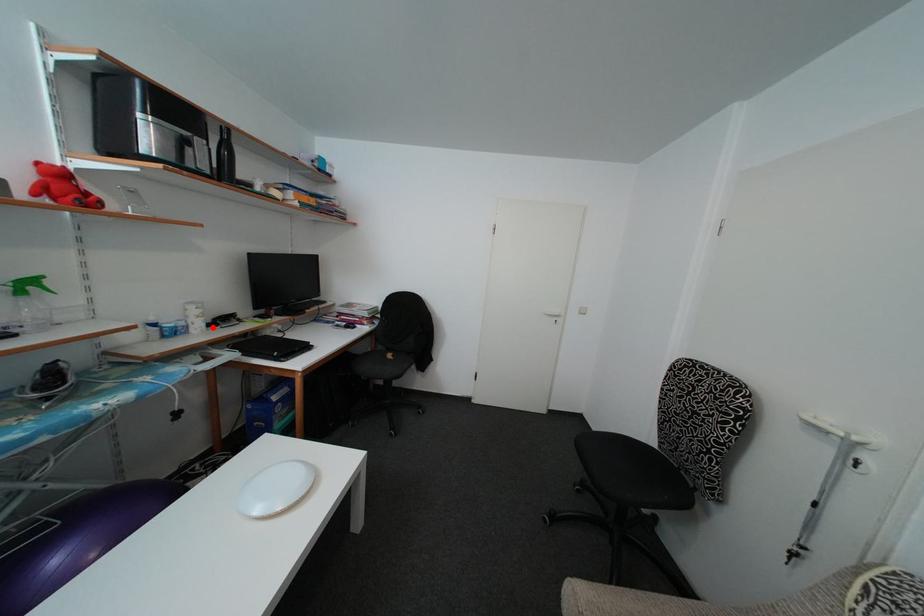
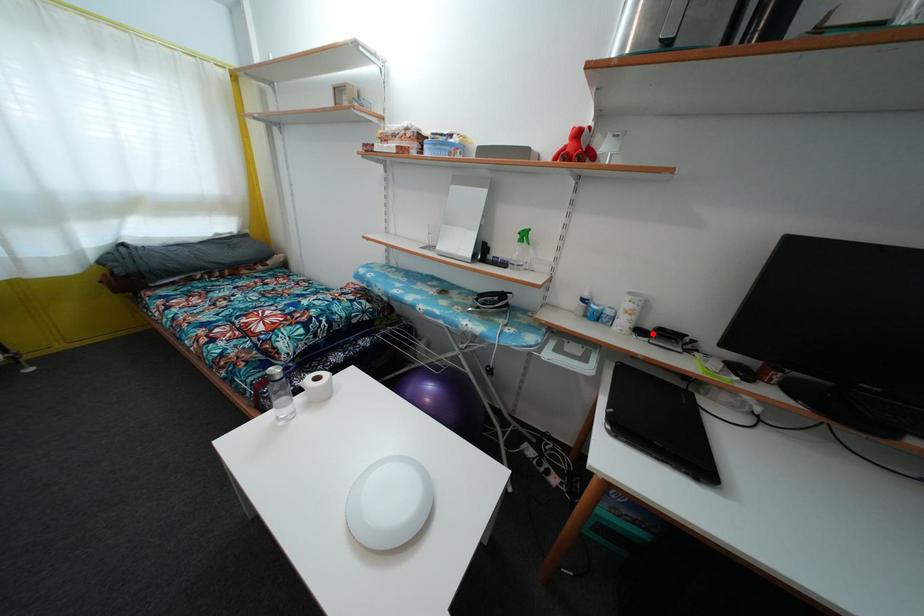
I am providing you with two images of the same scene from different viewpoints. A red point is marked on the first image and another point is marked on the second image. Does the point marked in image1 correspond to the same location as the one in image2?

Yes